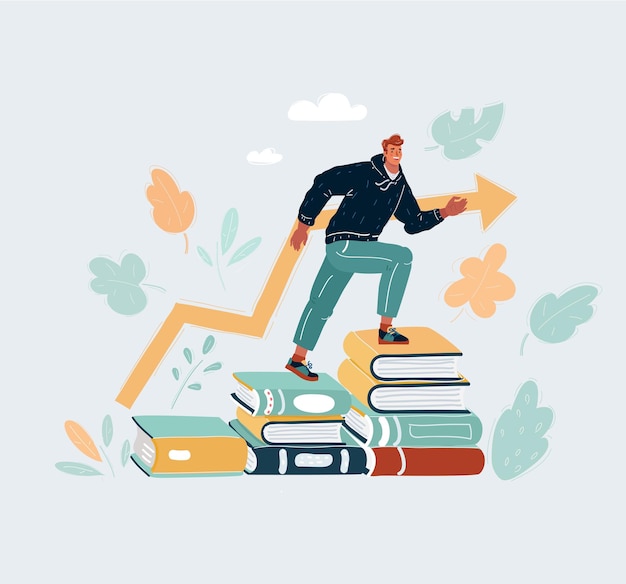
Where is `books`? This screenshot has width=626, height=584. books is located at coordinates (205, 446), (300, 465), (299, 426), (299, 402), (403, 365), (409, 396), (416, 429), (417, 457).